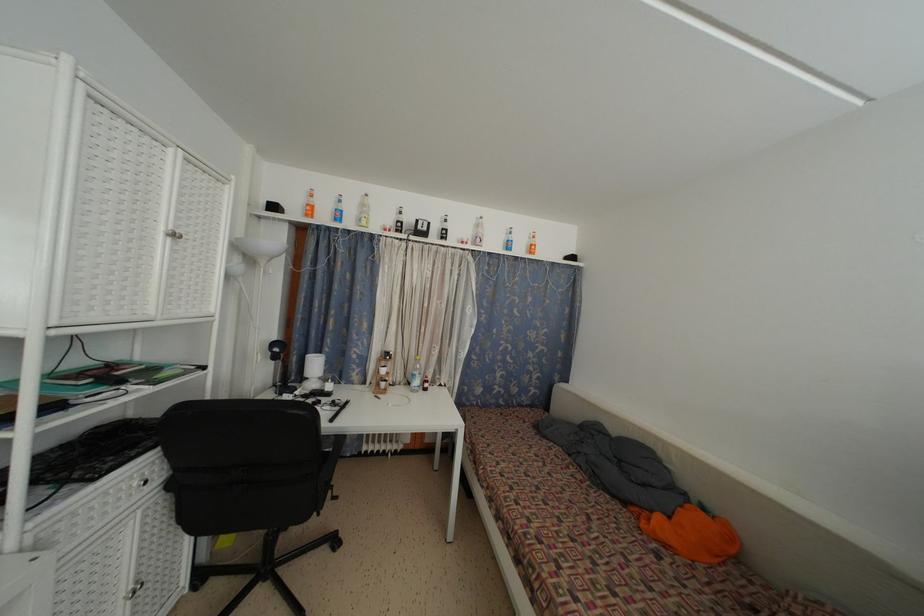
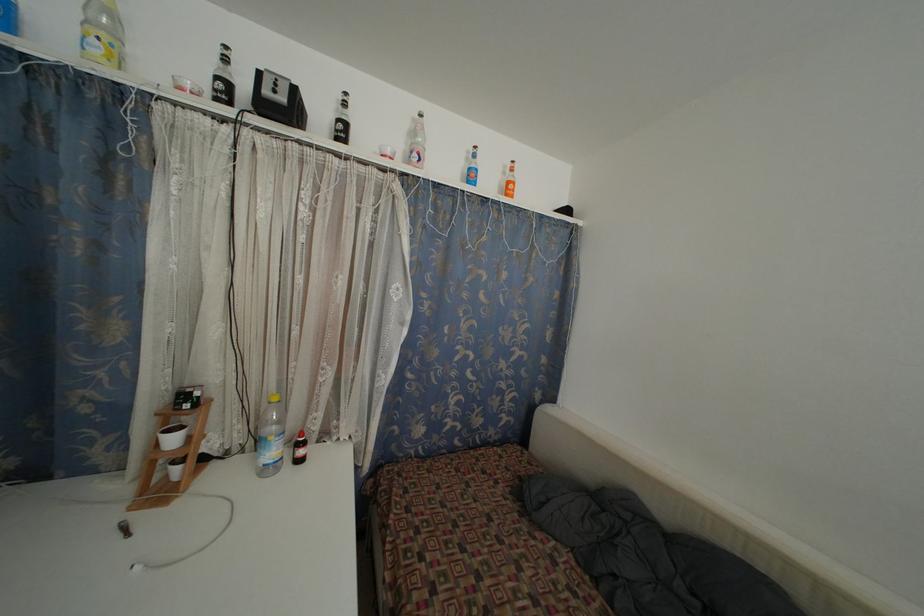
Where in the second image is the point corresponding to [420,227] from the first image?

(263, 79)